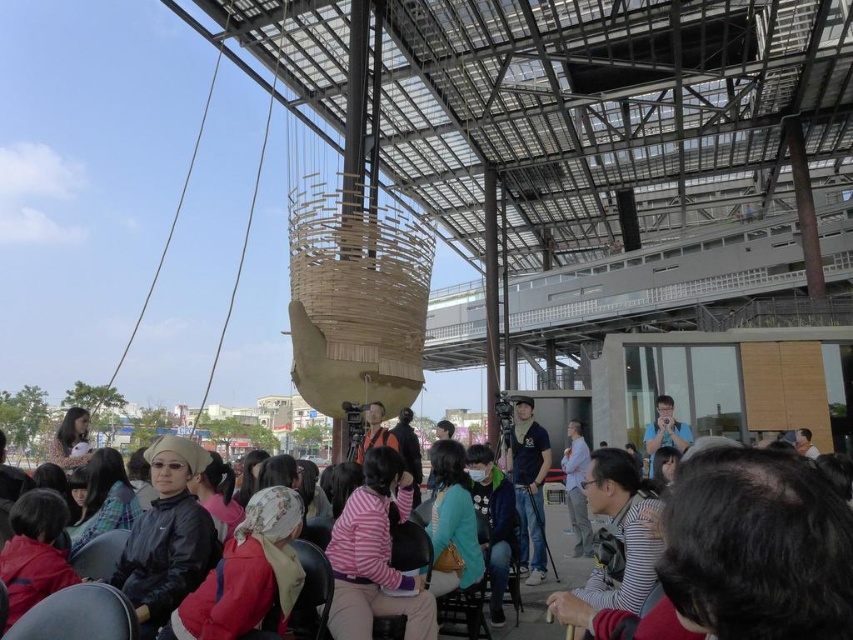
You are sitting in a black leather chair at center and want to see the person wearing a light blue shirt at center. Can you see their head?

The black leather chair at center is taller than the light blue shirt at center, so yes, you can see their head because the chair does not block the view.

You are a photographer standing at the back of the audience. You want to capture a photo of the denim jacket at center and the matte black jacket at center without any obstruction. Given that your camera has a maximum focus range of 1.5 meters, can you take the photo with both jackets in focus?

The distance between denim jacket at center and matte black jacket at center is 1.27 meters, which is within the camera maximum focus range of 1.5 meters. Therefore, both jackets can be captured in focus.